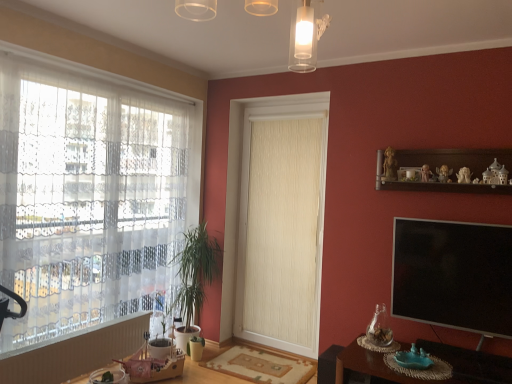
Question: Considering the relative positions of white lace curtain at left and wooden round table at lower left in the image provided, is white lace curtain at left to the right of wooden round table at lower left from the viewer's perspective?

Choices:
 (A) yes
 (B) no

Answer: (B)

Question: From the image's perspective, is white lace curtain at left on wooden round table at lower left?

Choices:
 (A) no
 (B) yes

Answer: (B)

Question: Is white lace curtain at left looking in the opposite direction of wooden round table at lower left?

Choices:
 (A) no
 (B) yes

Answer: (A)

Question: Does white lace curtain at left have a greater height compared to wooden round table at lower left?

Choices:
 (A) no
 (B) yes

Answer: (B)

Question: From a real-world perspective, is white lace curtain at left over wooden round table at lower left?

Choices:
 (A) yes
 (B) no

Answer: (A)

Question: Do you think translucent glass light fixture at upper center is within wooden round table at lower left, or outside of it?

Choices:
 (A) outside
 (B) inside

Answer: (A)

Question: Is translucent glass light fixture at upper center taller or shorter than wooden round table at lower left?

Choices:
 (A) tall
 (B) short

Answer: (A)

Question: Is translucent glass light fixture at upper center bigger or smaller than wooden round table at lower left?

Choices:
 (A) big
 (B) small

Answer: (B)

Question: Considering the positions of translucent glass light fixture at upper center and wooden round table at lower left in the image, is translucent glass light fixture at upper center wider or thinner than wooden round table at lower left?

Choices:
 (A) wide
 (B) thin

Answer: (B)

Question: From a real-world perspective, is brown wooden table at lower right positioned above or below black glossy tv at right?

Choices:
 (A) below
 (B) above

Answer: (A)

Question: Relative to black glossy tv at right, is brown wooden table at lower right in front or behind?

Choices:
 (A) front
 (B) behind

Answer: (A)

Question: From the image's perspective, relative to black glossy tv at right, is brown wooden table at lower right above or below?

Choices:
 (A) above
 (B) below

Answer: (B)

Question: Considering the positions of brown wooden table at lower right and black glossy tv at right in the image, is brown wooden table at lower right bigger or smaller than black glossy tv at right?

Choices:
 (A) small
 (B) big

Answer: (B)

Question: From a real-world perspective, is brown wooden table at lower right above or below beige textured curtain at center?

Choices:
 (A) below
 (B) above

Answer: (A)

Question: In the image, is brown wooden table at lower right positioned in front of or behind beige textured curtain at center?

Choices:
 (A) front
 (B) behind

Answer: (A)